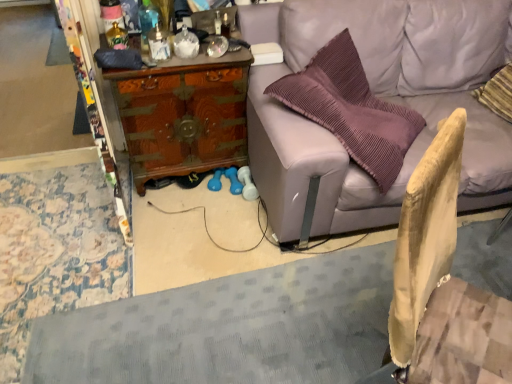
Question: In terms of size, does translucent glass bottle at upper center, the second bottle positioned from the left, appear bigger or smaller than wooden chest at center?

Choices:
 (A) small
 (B) big

Answer: (A)

Question: In the image, is translucent glass bottle at upper center, the second bottle positioned from the left, on the left side or the right side of wooden chest at center?

Choices:
 (A) right
 (B) left

Answer: (B)

Question: Which is nearer to the translucent glass bottle at upper left, which is the first bottle in left-to-right order?

Choices:
 (A) light brown wood swivel chair at lower right
 (B) wooden chest at center
 (C) light purple leather couch at upper right
 (D) translucent glass bottle at upper center, the second bottle positioned from the left

Answer: (D)

Question: Which object is positioned closest to the translucent glass bottle at upper center, the second bottle positioned from the left?

Choices:
 (A) translucent glass bottle at upper left, which appears as the 2th bottle when viewed from the right
 (B) light brown wood swivel chair at lower right
 (C) light purple leather couch at upper right
 (D) wooden chest at center

Answer: (A)